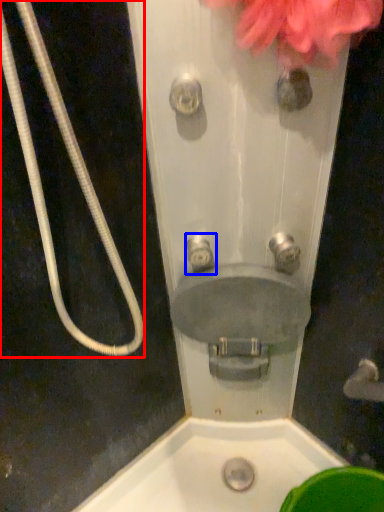
Question: Which of the following is the farthest to the observer, garden hose (highlighted by a red box) or plumbing fixture (highlighted by a blue box)?

Choices:
 (A) garden hose
 (B) plumbing fixture

Answer: (B)